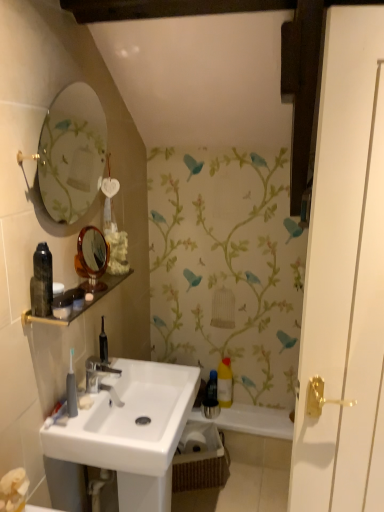
Find the location of a particular element. blank space situated above white glossy bath at lower right (from a real-world perspective) is located at coordinates (256, 411).